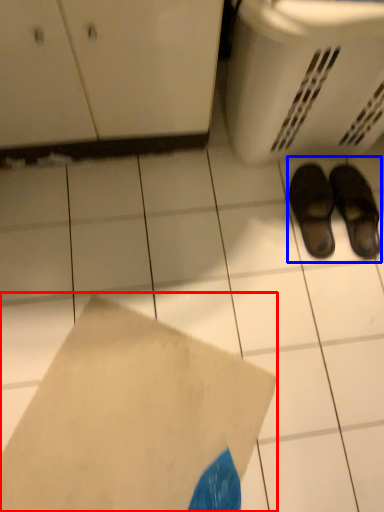
Question: Which point is further to the camera, envelope (highlighted by a red box) or footwear (highlighted by a blue box)?

Choices:
 (A) envelope
 (B) footwear

Answer: (B)